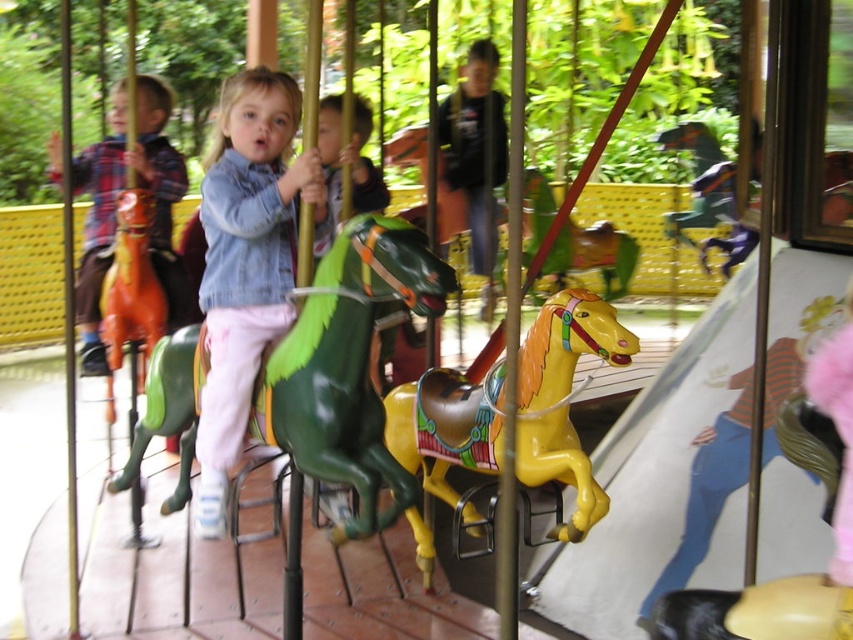
Question: Which object is positioned closest to the green glossy horse at center?

Choices:
 (A) matte orange horse at left
 (B) denim jacket at center
 (C) matte plaid shirt at left

Answer: (B)

Question: Is matte plaid shirt at left to the left of matte orange horse at left from the viewer's perspective?

Choices:
 (A) yes
 (B) no

Answer: (A)

Question: Is shiny yellow horse at center in front of matte orange horse at left?

Choices:
 (A) yes
 (B) no

Answer: (A)

Question: Is green glossy horse at center below shiny yellow horse at center?

Choices:
 (A) yes
 (B) no

Answer: (B)

Question: Which point is farther to the camera?

Choices:
 (A) matte orange horse at left
 (B) matte plaid shirt at left
 (C) shiny yellow horse at center

Answer: (A)

Question: Estimate the real-world distances between objects in this image. Which object is closer to the shiny yellow horse at center?

Choices:
 (A) matte orange horse at left
 (B) matte plaid shirt at left
 (C) green glossy horse at center
 (D) denim jacket at center

Answer: (C)